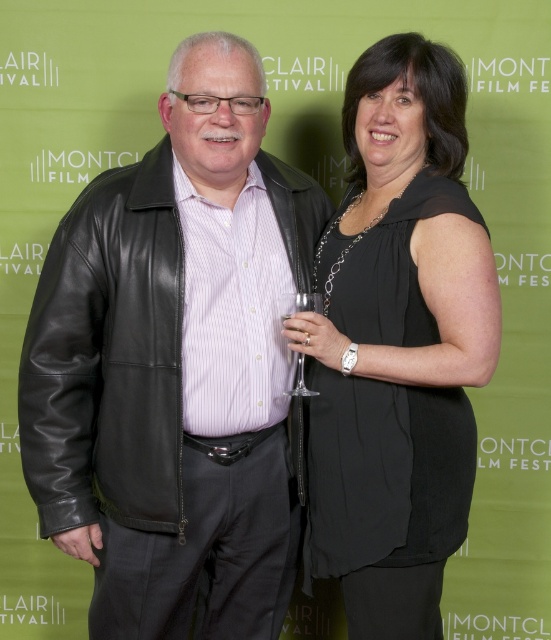
Between black satin dress at center and clear glass wine glass at center, which one has more height?

Standing taller between the two is black satin dress at center.

Is black satin dress at center below clear glass wine glass at center?

Correct, black satin dress at center is located below clear glass wine glass at center.

This screenshot has width=551, height=640. What are the coordinates of `black satin dress at center` in the screenshot? It's located at (397, 344).

Which is more to the right, black leather jacket at center or black satin dress at center?

black satin dress at center is more to the right.

Which is behind, point (246, 444) or point (401, 70)?

The point (246, 444) is behind.

Does point (159, 147) come farther from viewer compared to point (439, 461)?

That is True.

This screenshot has width=551, height=640. In order to click on black leather jacket at center in this screenshot , I will do `click(175, 365)`.

Between black leather jacket at center and clear glass wine glass at center, which one is positioned lower?

Positioned lower is black leather jacket at center.

The image size is (551, 640). What do you see at coordinates (175, 365) in the screenshot? I see `black leather jacket at center` at bounding box center [175, 365].

Locate an element on the screen. Image resolution: width=551 pixels, height=640 pixels. black leather jacket at center is located at coordinates (175, 365).